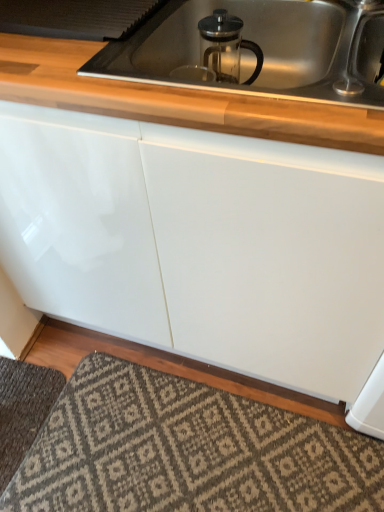
Question: Considering the positions of clear glass french press at upper center and dark gray textured rug at lower left, the 2th doormat from the right, in the image, is clear glass french press at upper center bigger or smaller than dark gray textured rug at lower left, the 2th doormat from the right,?

Choices:
 (A) small
 (B) big

Answer: (B)

Question: Is clear glass french press at upper center wider or thinner than dark gray textured rug at lower left, the 2th doormat from the right?

Choices:
 (A) thin
 (B) wide

Answer: (A)

Question: Which object is positioned farthest from the patterned carpet at lower center, which appears as the 2th doormat when viewed from the left?

Choices:
 (A) clear glass french press at upper center
 (B) satin nickel faucet at upper right
 (C) dark gray textured rug at lower left, which appears as the 1th doormat when viewed from the left
 (D) white glossy countertop at upper center

Answer: (B)

Question: Considering the real-world distances, which object is closest to the white glossy countertop at upper center?

Choices:
 (A) clear glass french press at upper center
 (B) patterned carpet at lower center, placed as the 1th doormat when sorted from right to left
 (C) satin nickel faucet at upper right
 (D) dark gray textured rug at lower left, the 2th doormat from the right

Answer: (C)